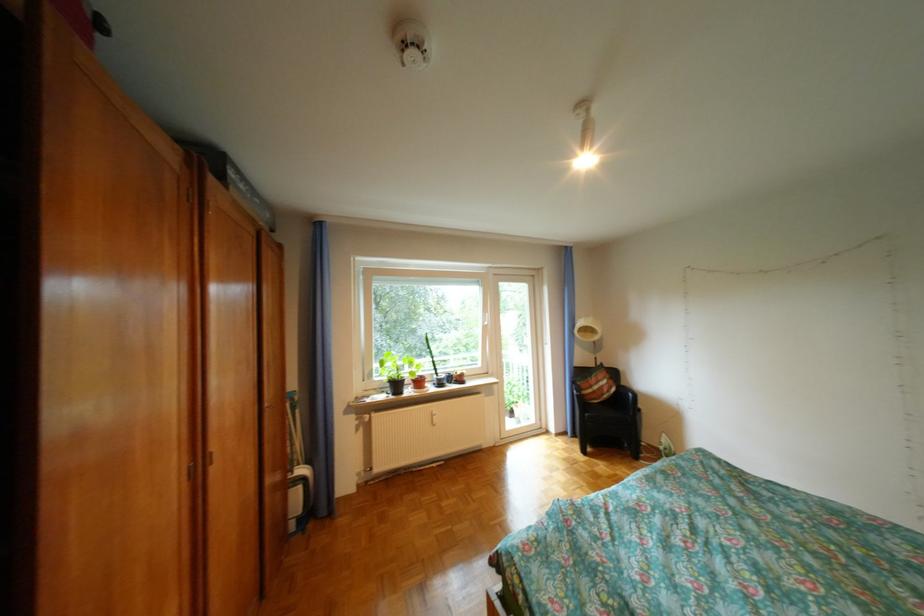
Locate an element on the screen. radiator panel handle is located at coordinates (433, 416).